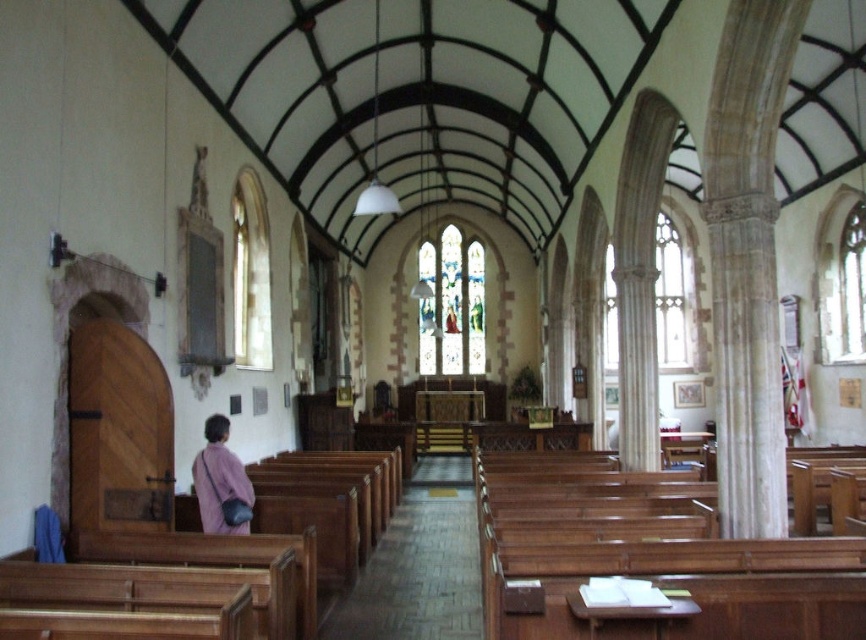
Between point (401, 545) and point (237, 470), which one is positioned in front?

Point (237, 470) is more forward.

Can you confirm if brown wooden aisle at center is positioned to the right of pink fabric bag at lower left?

Correct, you'll find brown wooden aisle at center to the right of pink fabric bag at lower left.

From the picture: Measure the distance between brown wooden aisle at center and camera.

They are 77.89 feet apart.

Locate an element on the screen. This screenshot has width=866, height=640. brown wooden aisle at center is located at coordinates (x=419, y=564).